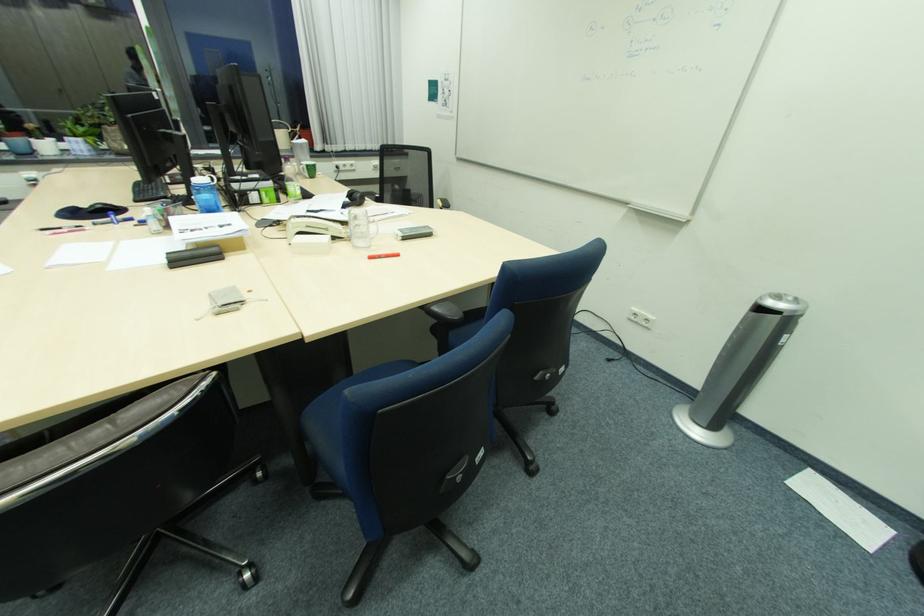
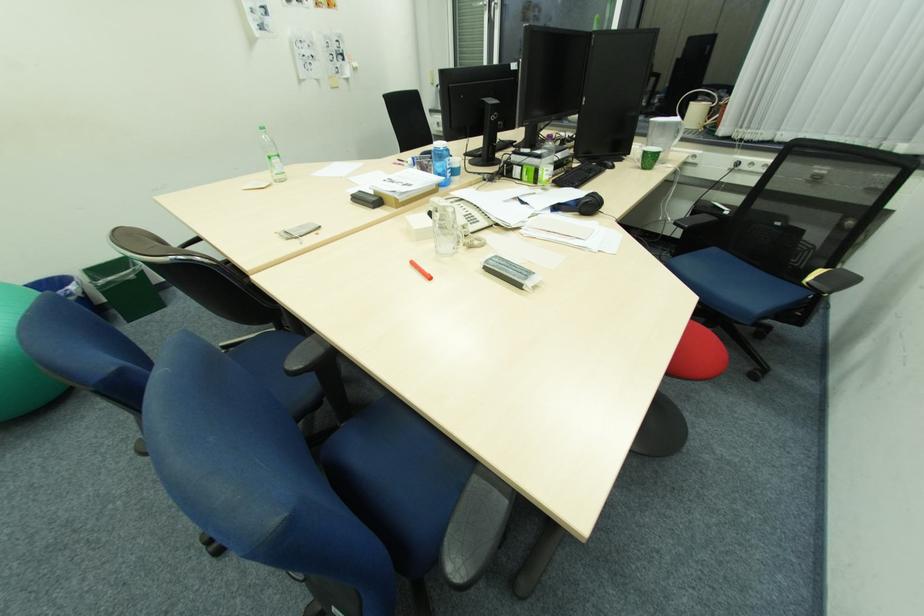
In the second image, find the point that corresponds to [314,167] in the first image.

(650, 153)